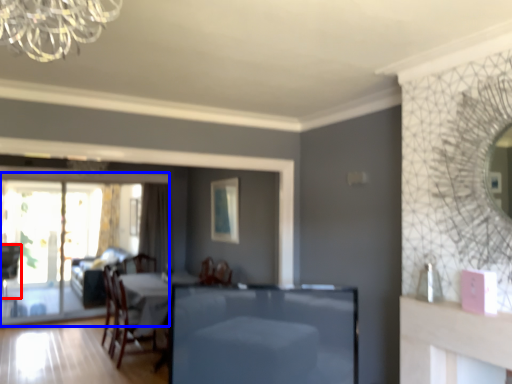
Question: Which point is further to the camera, chair (highlighted by a red box) or screen door (highlighted by a blue box)?

Choices:
 (A) chair
 (B) screen door

Answer: (A)